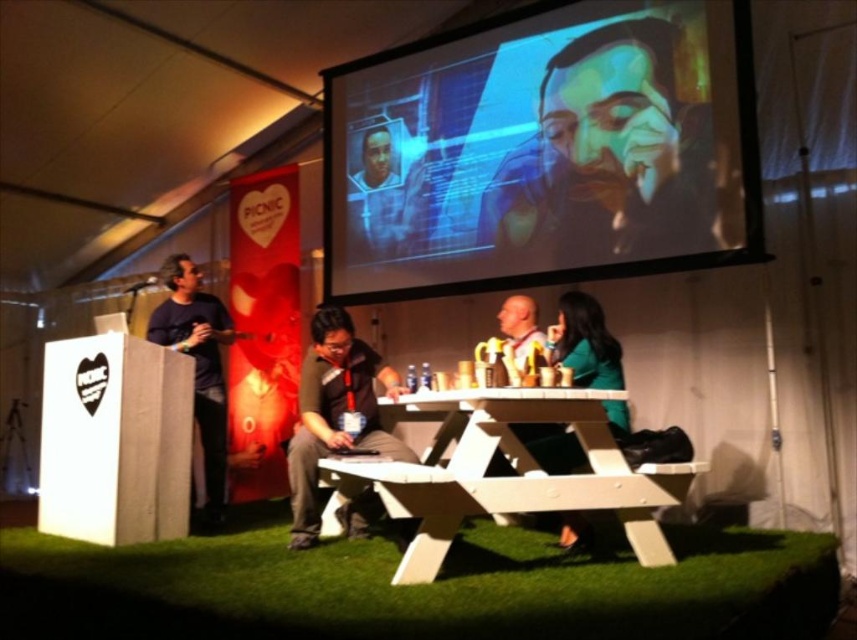
Does point (324, 420) come farther from viewer compared to point (202, 310)?

That is False.

Who is more forward, (364,422) or (214,490)?

Point (364,422) is in front.

You are a GUI agent. You are given a task and a screenshot of the screen. Output one action in this format:
    pyautogui.click(x=<x>, y=<y>)
    Task: Click on the matte black jacket at center
    This screenshot has height=640, width=857.
    Given the screenshot: What is the action you would take?
    pyautogui.click(x=334, y=412)

How distant is matte plastic projection screen at upper center from matte black jacket at center?

The distance of matte plastic projection screen at upper center from matte black jacket at center is 1.66 meters.

Can you confirm if matte plastic projection screen at upper center is positioned to the left of matte black jacket at center?

In fact, matte plastic projection screen at upper center is to the right of matte black jacket at center.

Who is more distant from viewer, (423, 93) or (358, 365)?

Positioned behind is point (423, 93).

In order to click on matte plastic projection screen at upper center in this screenshot , I will do `click(544, 150)`.

Is matte plastic projection screen at upper center wider than dark blue shirt at left?

Indeed, matte plastic projection screen at upper center has a greater width compared to dark blue shirt at left.

Is matte plastic projection screen at upper center to the right of dark blue shirt at left from the viewer's perspective?

Yes, matte plastic projection screen at upper center is to the right of dark blue shirt at left.

Is point (662, 214) farther from viewer compared to point (166, 312)?

No, it is not.

In order to click on matte plastic projection screen at upper center in this screenshot , I will do `click(544, 150)`.